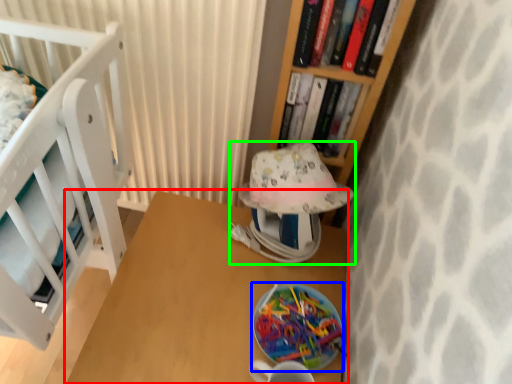
Question: Estimate the real-world distances between objects in this image. Which object is farther from table (highlighted by a red box), plate (highlighted by a blue box) or table lamp (highlighted by a green box)?

Choices:
 (A) plate
 (B) table lamp

Answer: (B)